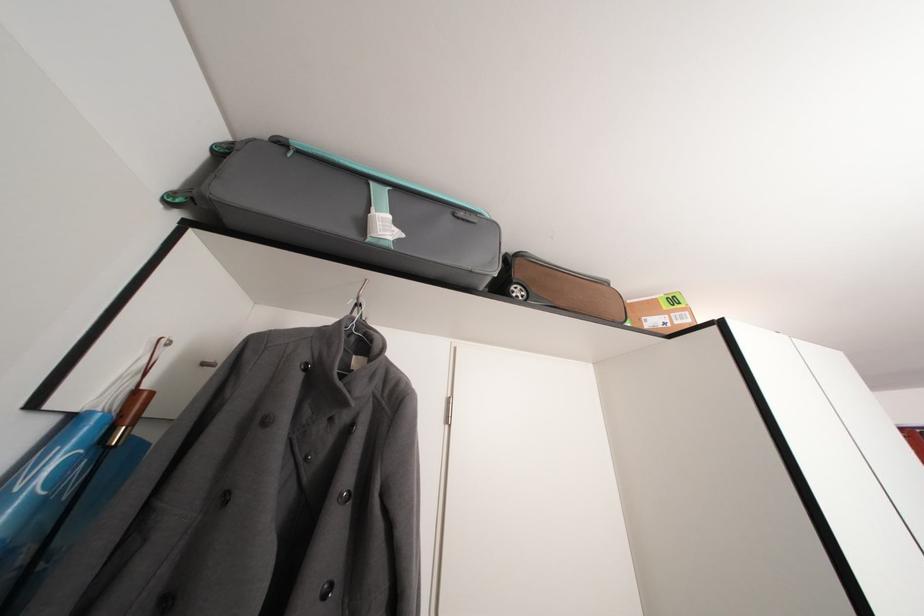
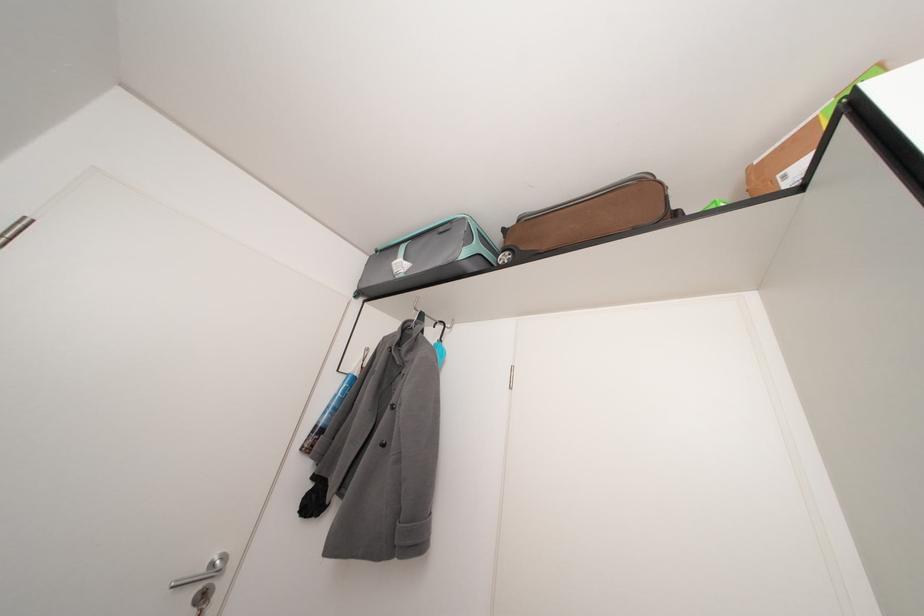
In the second image, find the point that corresponds to [636,307] in the first image.

(763, 168)